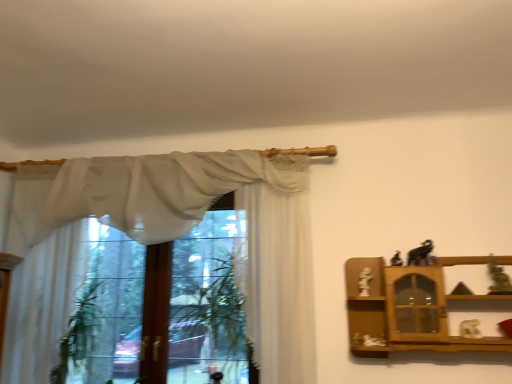
Question: Does matte black elephant at upper right, the fourth toy in the right-to-left sequence, have a larger size compared to matte black elephant at upper right, arranged as the 3th toy when viewed from the right?

Choices:
 (A) yes
 (B) no

Answer: (B)

Question: From a real-world perspective, is matte black elephant at upper right, the fourth toy in the right-to-left sequence, on top of matte black elephant at upper right, arranged as the 3th toy when viewed from the right?

Choices:
 (A) yes
 (B) no

Answer: (B)

Question: From the image's perspective, is matte black elephant at upper right, the fourth toy in the right-to-left sequence, located above matte black elephant at upper right, positioned as the 3th toy in left-to-right order?

Choices:
 (A) yes
 (B) no

Answer: (B)

Question: Is matte black elephant at upper right, the fourth toy in the right-to-left sequence, positioned with its back to matte black elephant at upper right, positioned as the 3th toy in left-to-right order?

Choices:
 (A) yes
 (B) no

Answer: (B)

Question: Is matte black elephant at upper right, the fourth toy in the right-to-left sequence, not near matte black elephant at upper right, positioned as the 3th toy in left-to-right order?

Choices:
 (A) yes
 (B) no

Answer: (B)

Question: In the image, is white matte statue at right, which is counted as the 1th toy, starting from the left, on the left side or the right side of sheer white curtain at upper left, which is the 2th curtain in left-to-right order?

Choices:
 (A) left
 (B) right

Answer: (B)

Question: In terms of width, does white matte statue at right, the fifth toy in the right-to-left sequence, look wider or thinner when compared to sheer white curtain at upper left, which is the 2th curtain in left-to-right order?

Choices:
 (A) wide
 (B) thin

Answer: (B)

Question: In terms of height, does white matte statue at right, the fifth toy in the right-to-left sequence, look taller or shorter compared to sheer white curtain at upper left, which is the 2th curtain in left-to-right order?

Choices:
 (A) tall
 (B) short

Answer: (B)

Question: Relative to sheer white curtain at upper left, which is the 2th curtain in left-to-right order, is white matte statue at right, which is counted as the 1th toy, starting from the left, in front or behind?

Choices:
 (A) front
 (B) behind

Answer: (B)

Question: Is matte black elephant at upper right, the fourth toy in the right-to-left sequence, in front of or behind matte black elephant at upper right, arranged as the 3th toy when viewed from the right, in the image?

Choices:
 (A) front
 (B) behind

Answer: (B)

Question: From their relative heights in the image, would you say matte black elephant at upper right, the fourth toy in the right-to-left sequence, is taller or shorter than matte black elephant at upper right, arranged as the 3th toy when viewed from the right?

Choices:
 (A) tall
 (B) short

Answer: (B)

Question: Does point (399, 258) appear closer or farther from the camera than point (423, 256)?

Choices:
 (A) farther
 (B) closer

Answer: (A)

Question: Is matte black elephant at upper right, the fourth toy in the right-to-left sequence, inside or outside of matte black elephant at upper right, arranged as the 3th toy when viewed from the right?

Choices:
 (A) inside
 (B) outside

Answer: (B)

Question: In terms of width, does white sheer curtain at left, which ranks as the first curtain in left-to-right order, look wider or thinner when compared to matte black elephant at upper right, which is the 2th toy in left-to-right order?

Choices:
 (A) thin
 (B) wide

Answer: (B)

Question: Would you say white sheer curtain at left, acting as the third curtain starting from the right, is inside or outside matte black elephant at upper right, which is the 2th toy in left-to-right order?

Choices:
 (A) inside
 (B) outside

Answer: (B)